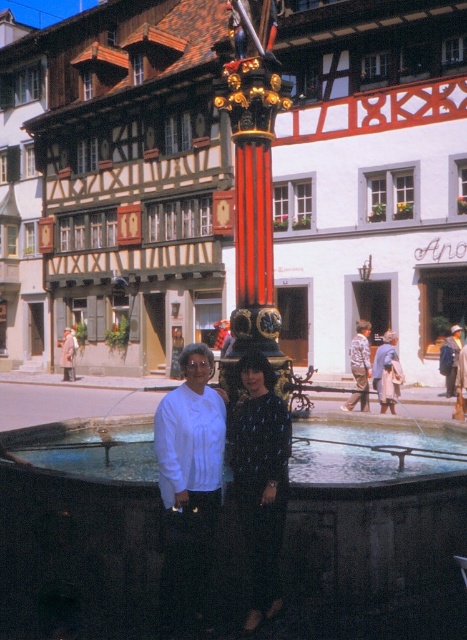
Question: Which point is farther to the camera?

Choices:
 (A) matte white blouse at center
 (B) blue denim jacket at lower right
 (C) dark stone fountain at center
 (D) matte black dress at center

Answer: (B)

Question: Which object is closer to the camera taking this photo?

Choices:
 (A) matte white blouse at center
 (B) dark stone fountain at center

Answer: (B)

Question: Does matte black dress at center have a lesser width compared to printed cotton shirt at center?

Choices:
 (A) yes
 (B) no

Answer: (B)

Question: Which of the following is the closest to the observer?

Choices:
 (A) (280, 602)
 (B) (348, 515)
 (C) (178, 588)

Answer: (C)

Question: Is matte white blouse at center closer to the viewer compared to dark blue textured dress at center?

Choices:
 (A) yes
 (B) no

Answer: (B)

Question: Can you confirm if dark stone fountain at center is smaller than printed cotton shirt at center?

Choices:
 (A) yes
 (B) no

Answer: (B)